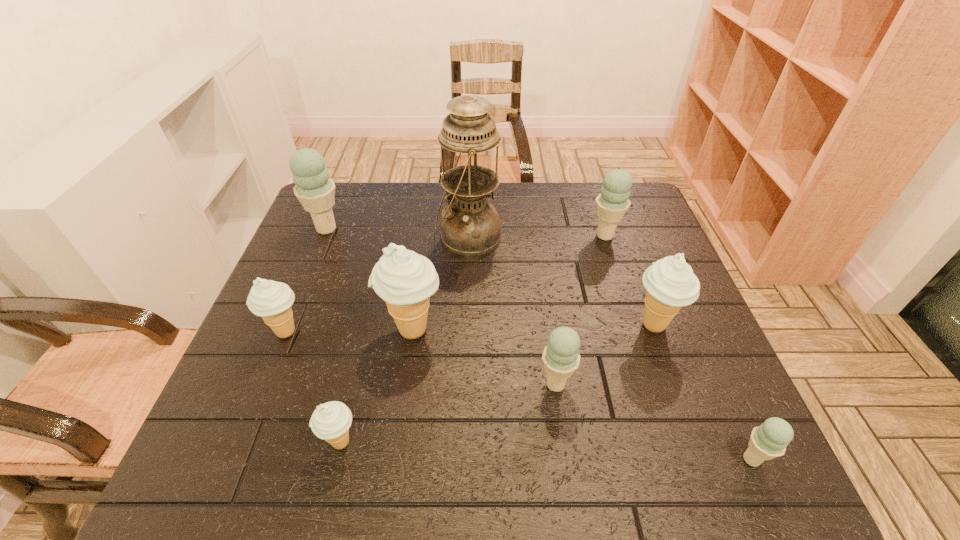
Find the location of a particular element. This screenshot has height=540, width=960. the rightmost object is located at coordinates (769, 440).

You are a GUI agent. You are given a task and a screenshot of the screen. Output one action in this format:
    pyautogui.click(x=<x>, y=<y>)
    Task: Click on the vacant space located 0.240m on the left of the oil lamp
    This screenshot has width=960, height=540.
    Given the screenshot: What is the action you would take?
    pyautogui.click(x=353, y=237)

Identify the location of vacant space positioned on the right of the biggest blue ice cream. This screenshot has width=960, height=540. (468, 228).

I want to click on vacant space located on the front of the biggest beige icecream, so click(403, 395).

At what (x,y) coordinates should I click in order to perform the action: click on free region located 0.210m on the front of the second blue ice cream from right to left. Please return your answer as a coordinate pair (x, y). Looking at the image, I should click on (626, 300).

Identify the location of vacant space located 0.110m on the left of the third smallest beige icecream. (582, 325).

The width and height of the screenshot is (960, 540). I want to click on free spot located 0.300m on the back of the leftmost beige icecream, so click(324, 237).

What are the coordinates of `free location located on the right of the third nearest object` in the screenshot? It's located at (694, 384).

Find the location of `vacant area situated 0.340m on the back of the smallest beige icecream`. vacant area situated 0.340m on the back of the smallest beige icecream is located at coordinates (374, 297).

Image resolution: width=960 pixels, height=540 pixels. Identify the location of vacant position located on the back of the smallest blue ice cream. (681, 300).